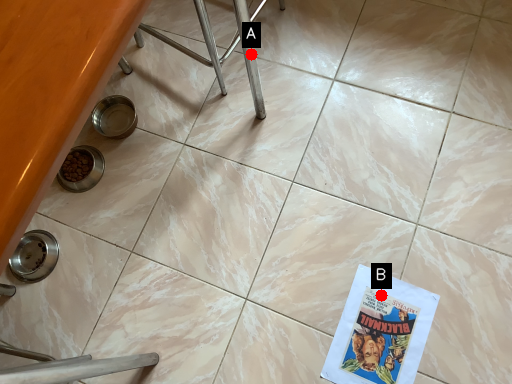
Question: Two points are circled on the image, labeled by A and B beside each circle. Which point appears farthest from the camera in this image?

Choices:
 (A) A is further
 (B) B is further

Answer: (A)